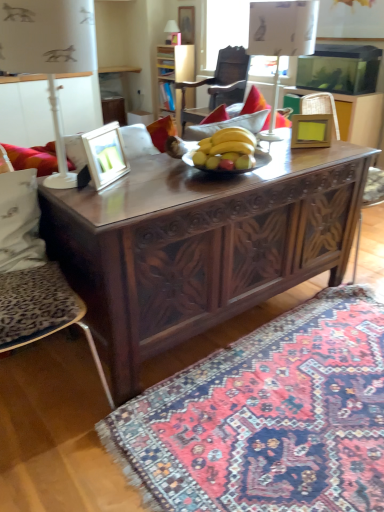
Where is `vacant space in front of matte wooden picture frame at left, the 1th picture frame in the left-to-right sequence`? vacant space in front of matte wooden picture frame at left, the 1th picture frame in the left-to-right sequence is located at coordinates (107, 193).